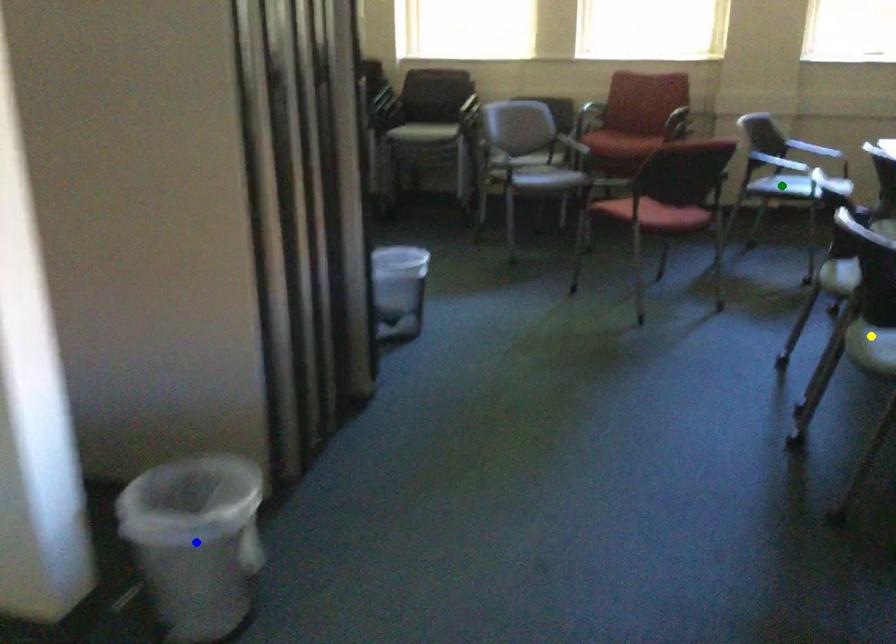
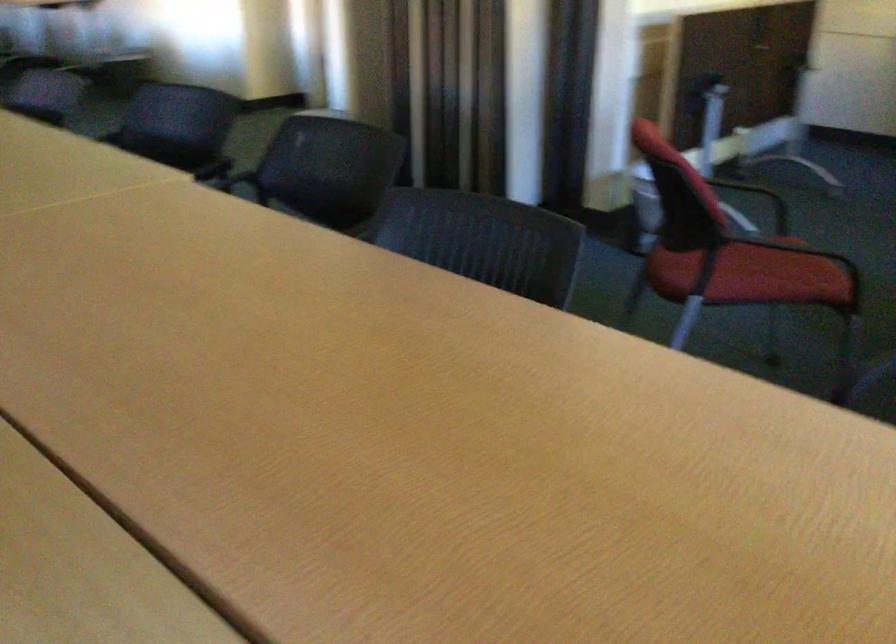
I am providing you with two images of the same scene from different viewpoints. Three points are marked in image1. Which point corresponds to a part or object that is occluded in image2?In image1, three points are marked. Which of them correspond to a part or object that is occluded in image2?Among the three points shown in image1, which one corresponds to a part or object that is no longer visible due to occlusion in image2?

Invisible in image2: yellow point, blue point, green point.